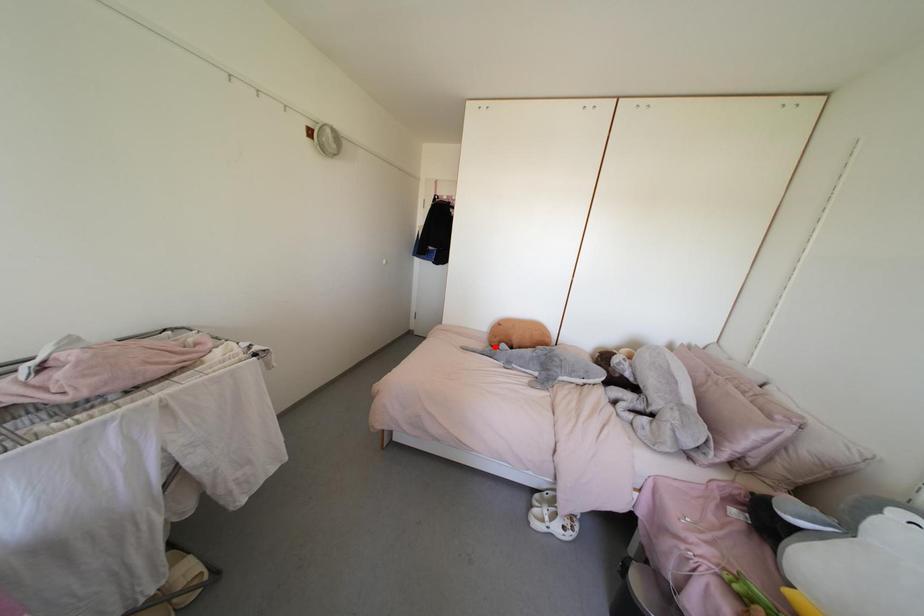
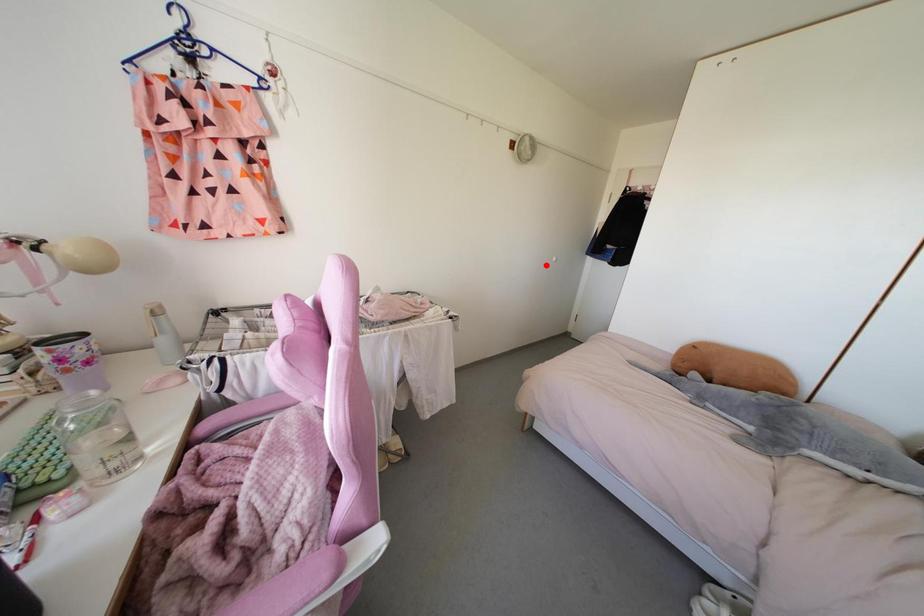
I am providing you with two images of the same scene from different viewpoints. A red point is marked on the first image and another point is marked on the second image. Is the marked point in image1 the same physical position as the marked point in image2?

No